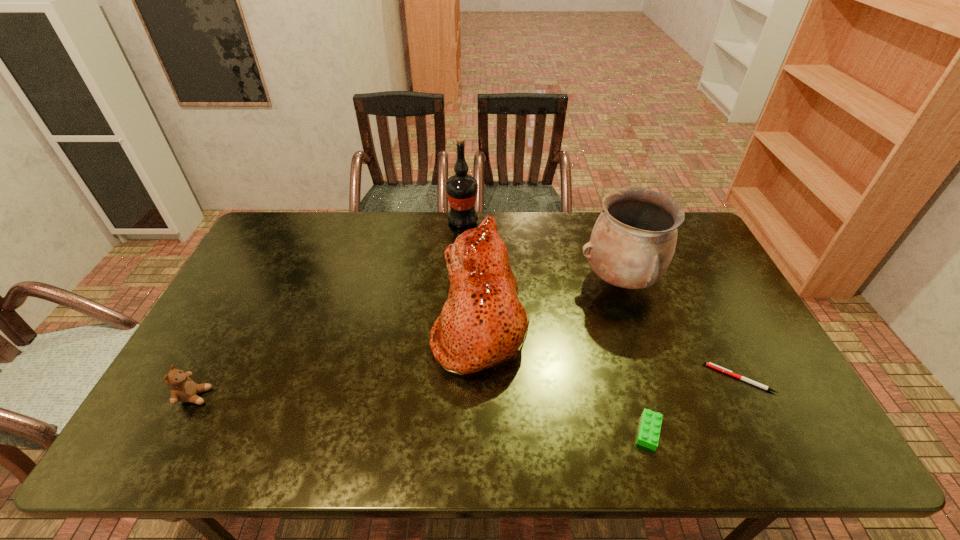
The height and width of the screenshot is (540, 960). What are the coordinates of `object that is positioned at the near edge` in the screenshot? It's located at (649, 431).

The image size is (960, 540). I want to click on object located in the left edge section of the desktop, so click(x=183, y=389).

This screenshot has height=540, width=960. I want to click on object that is at the right edge, so click(709, 364).

Find the location of a particular element. vacant area at the far edge of the desktop is located at coordinates (563, 249).

Locate an element on the screen. Image resolution: width=960 pixels, height=540 pixels. vacant space at the near edge is located at coordinates (288, 453).

I want to click on vacant space at the left edge of the desktop, so click(x=265, y=283).

This screenshot has width=960, height=540. Find the location of `free location at the right edge`. free location at the right edge is located at coordinates (727, 363).

In the image, there is a desktop. Where is `vacant space at the near left corner`? vacant space at the near left corner is located at coordinates (178, 431).

Image resolution: width=960 pixels, height=540 pixels. I want to click on free spot between the Lego and the urn, so click(635, 356).

You are a GUI agent. You are given a task and a screenshot of the screen. Output one action in this format:
    pyautogui.click(x=<x>, y=<y>)
    Task: Click on the blank region between the cat and the Lego
    This screenshot has height=540, width=960.
    Given the screenshot: What is the action you would take?
    pyautogui.click(x=564, y=377)